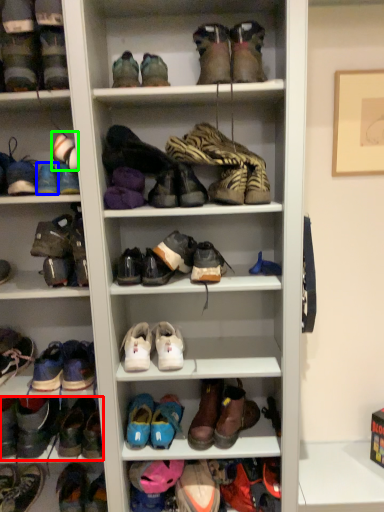
Question: Which object is positioned farthest from footwear (highlighted by a red box)? Select from shoe (highlighted by a blue box) and shoe (highlighted by a green box).

Choices:
 (A) shoe
 (B) shoe

Answer: (B)